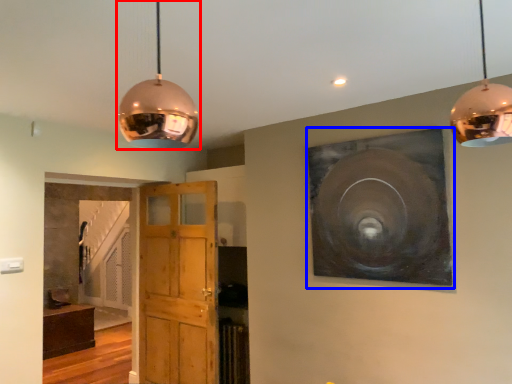
Question: Which object is closer to the camera taking this photo, lamp (highlighted by a red box) or picture frame (highlighted by a blue box)?

Choices:
 (A) lamp
 (B) picture frame

Answer: (A)